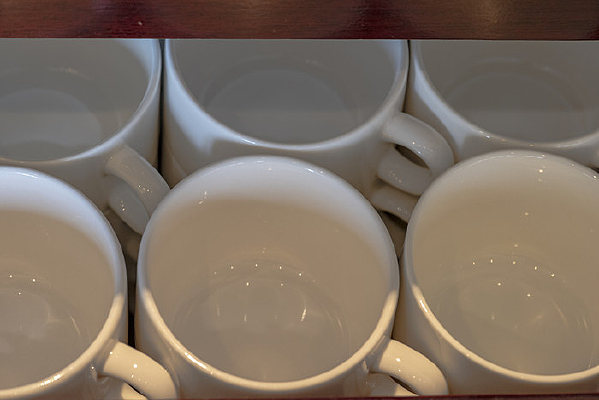
Where is `white mugs`? white mugs is located at coordinates 98,118, 60,289, 262,314, 347,143, 528,107, 527,285.